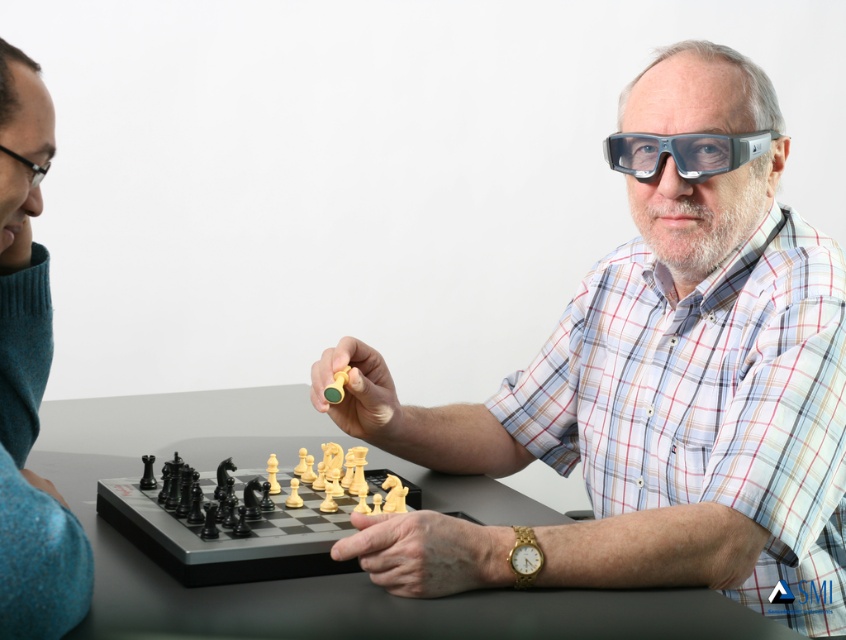
Question: Which object appears closest to the camera in this image?

Choices:
 (A) black plastic table at center
 (B) teal wool sweater at left
 (C) transparent plastic goggles at center
 (D) clear plastic glasses at center

Answer: (B)

Question: Can you confirm if black plastic table at center is positioned to the right of transparent plastic goggles at center?

Choices:
 (A) no
 (B) yes

Answer: (A)

Question: In this image, where is clear plastic glasses at center located relative to teal wool sweater at left?

Choices:
 (A) left
 (B) right

Answer: (B)

Question: Among these points, which one is farthest from the camera?

Choices:
 (A) (3, 464)
 (B) (402, 484)
 (C) (261, 433)

Answer: (C)

Question: Is black plastic chess pieces at center closer to camera compared to transparent plastic goggles at center?

Choices:
 (A) yes
 (B) no

Answer: (A)

Question: Based on their relative distances, which object is farther from the black plastic chess pieces at center?

Choices:
 (A) clear plastic glasses at center
 (B) black plastic table at center

Answer: (A)